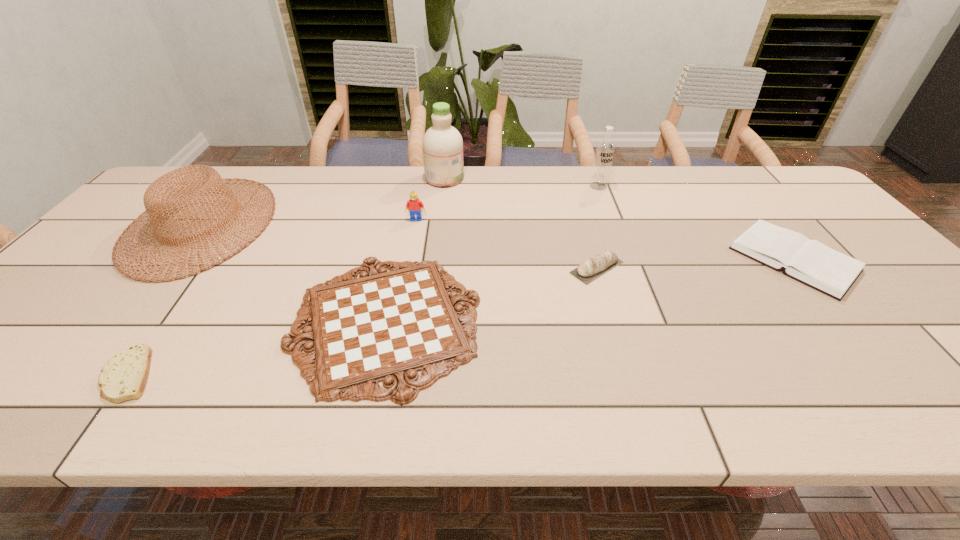
What are the coordinates of `the shorter pita bread` in the screenshot? It's located at pyautogui.click(x=124, y=376).

Find the location of a particular element. Image resolution: width=960 pixels, height=540 pixels. vacant space situated 0.260m on the front label of the tallest object is located at coordinates (541, 178).

Image resolution: width=960 pixels, height=540 pixels. What are the coordinates of `vacant space located 0.130m on the front label of the vodka` in the screenshot? It's located at (609, 214).

Where is `vacant position located on the right of the sunhat`? vacant position located on the right of the sunhat is located at coordinates (294, 224).

This screenshot has height=540, width=960. Identify the location of vacant region located 0.220m on the face of the Lego. (407, 271).

What are the coordinates of `vacant space positioned 0.310m on the left of the farther pita bread` in the screenshot? It's located at (448, 267).

You are a GUI agent. You are given a task and a screenshot of the screen. Output one action in this format:
    pyautogui.click(x=<x>, y=<y>)
    Task: Click on the free location located 0.270m on the front of the rightmost object
    The height and width of the screenshot is (540, 960).
    Given the screenshot: What is the action you would take?
    pyautogui.click(x=911, y=401)

The width and height of the screenshot is (960, 540). What are the coordinates of `free space located 0.150m on the back of the chessboard` in the screenshot? It's located at (406, 228).

This screenshot has width=960, height=540. I want to click on free spot located 0.190m on the left of the nearer pita bread, so click(x=10, y=375).

Find the location of `cleansing agent that is at the far edge`. cleansing agent that is at the far edge is located at coordinates (442, 143).